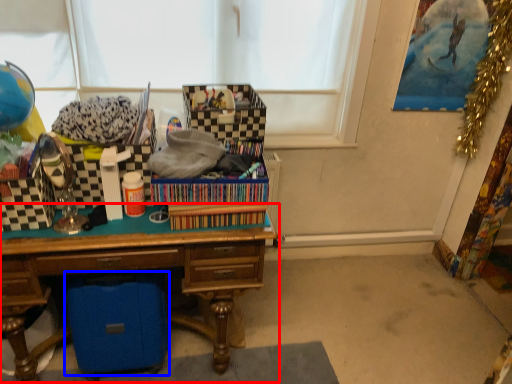
Question: Which object is further to the camera taking this photo, desk (highlighted by a red box) or storage box (highlighted by a blue box)?

Choices:
 (A) desk
 (B) storage box

Answer: (B)